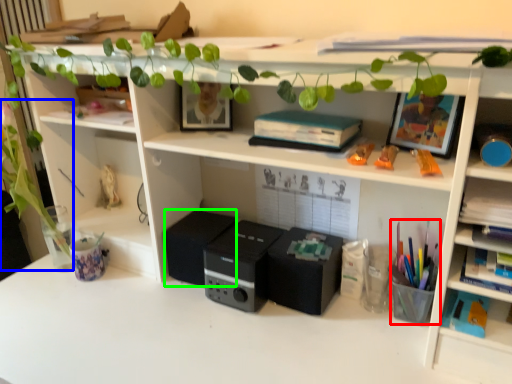
Question: Which is farther away from stationery (highlighted by a red box)? plant (highlighted by a blue box) or speaker (highlighted by a green box)?

Choices:
 (A) plant
 (B) speaker

Answer: (A)